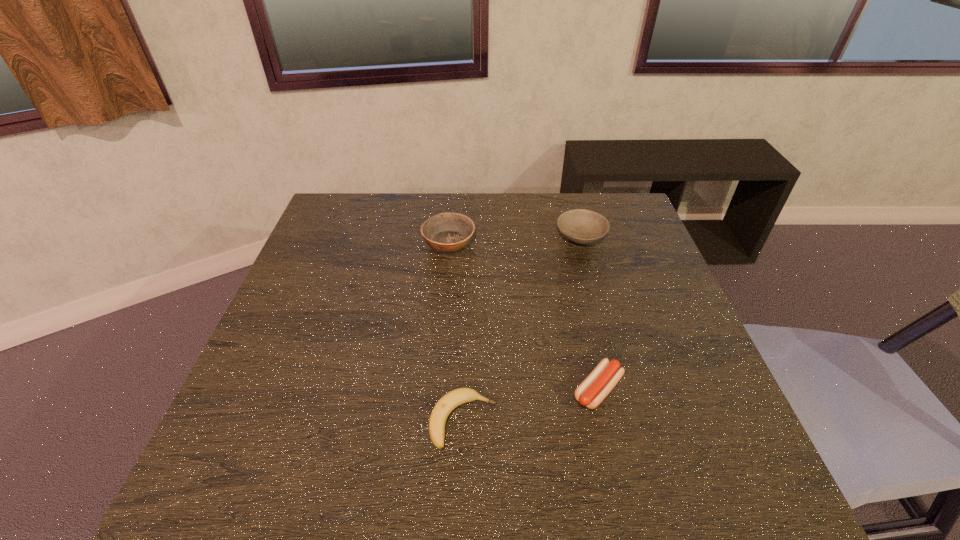
The width and height of the screenshot is (960, 540). Identify the location of free space that satisfies the following two spatial constraints: 1. on the front side of the left bowl; 2. on the left side of the banana. (433, 421).

Identify the location of vacant position in the image that satisfies the following two spatial constraints: 1. on the back side of the shortest object; 2. on the right side of the third tallest object. The image size is (960, 540). (465, 390).

Image resolution: width=960 pixels, height=540 pixels. I want to click on vacant space that satisfies the following two spatial constraints: 1. on the back side of the right bowl; 2. on the right side of the left bowl, so click(449, 236).